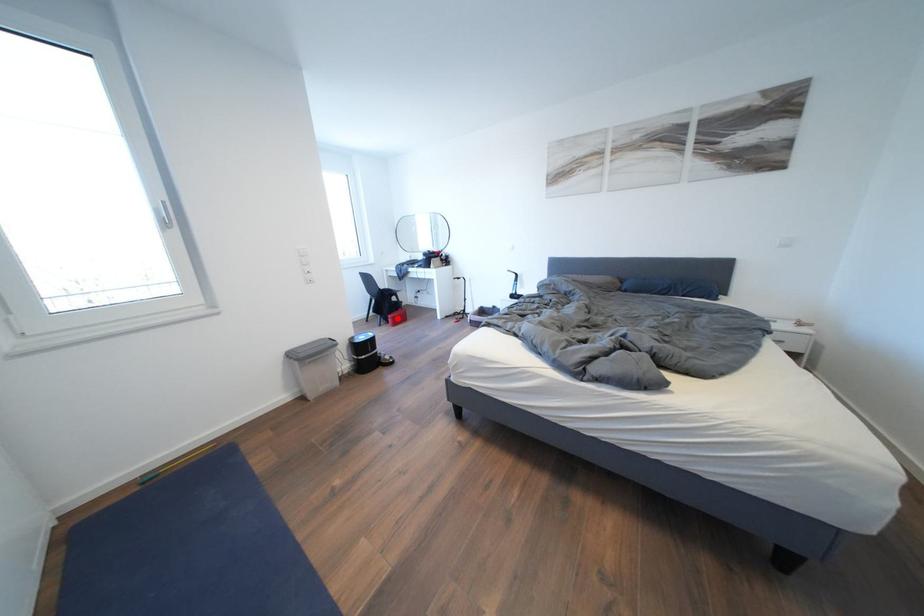
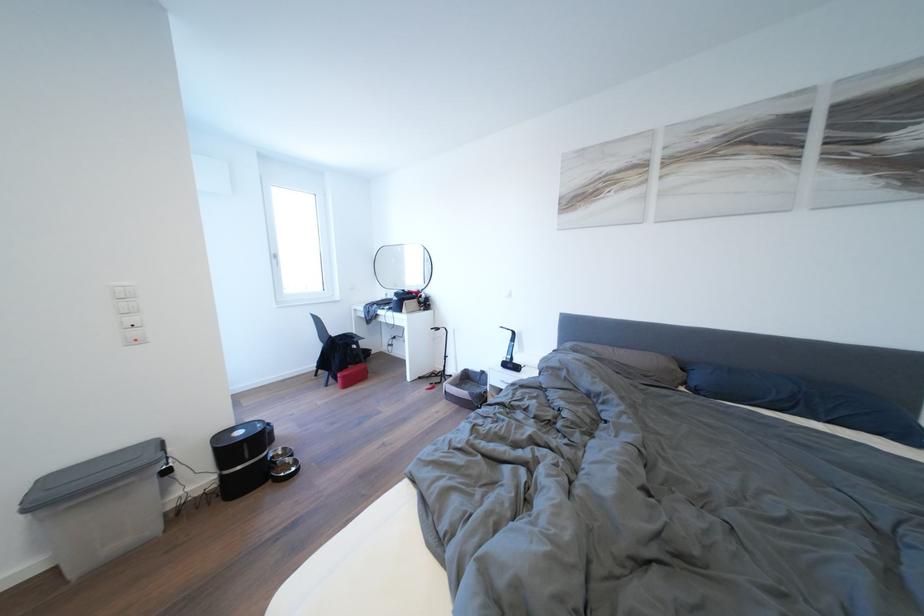
Question: A red point is marked in image1. In image2, is the corresponding 3D point closer to the camera or farther? Reply with the corresponding letter.

Choices:
 (A) The corresponding 3D point is closer.
 (B) The corresponding 3D point is farther.

Answer: (A)